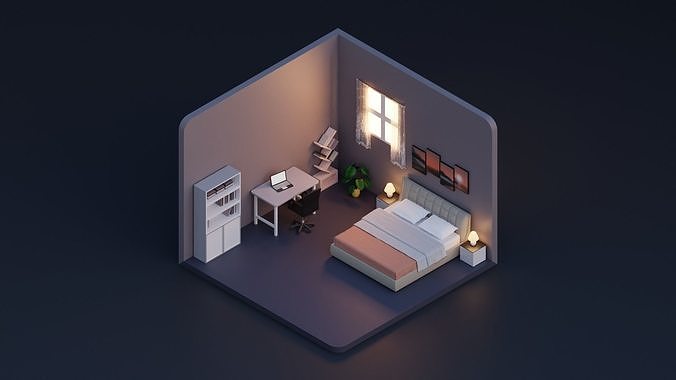
The image size is (676, 380). I want to click on pillow, so click(434, 222).